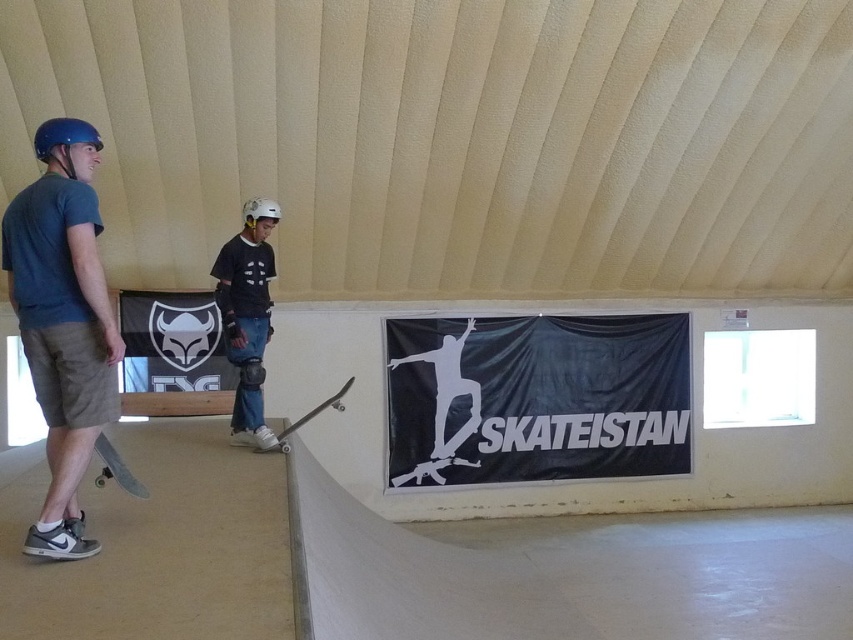
Between matte blue helmet at left and wooden skateboard at lower left, which one has more height?

With more height is matte blue helmet at left.

Who is more distant from viewer, (97, 541) or (96, 436)?

The point (96, 436) is behind.

Image resolution: width=853 pixels, height=640 pixels. Find the location of `matte blue helmet at left`. matte blue helmet at left is located at coordinates (62, 321).

Between white smooth ramp at center and wooden skateboard at center, which one is positioned higher?

Positioned higher is wooden skateboard at center.

The height and width of the screenshot is (640, 853). I want to click on white smooth ramp at center, so click(405, 576).

You are a GUI agent. You are given a task and a screenshot of the screen. Output one action in this format:
    pyautogui.click(x=<x>, y=<y>)
    Task: Click on the white smooth ramp at center
    The width and height of the screenshot is (853, 640).
    Given the screenshot: What is the action you would take?
    click(405, 576)

Where is `matte blue helmet at left`? The image size is (853, 640). matte blue helmet at left is located at coordinates [x=62, y=321].

How distant is matte blue helmet at left from wooden skateboard at center?

The distance of matte blue helmet at left from wooden skateboard at center is 6.44 feet.

Between point (62, 490) and point (283, 432), which one is positioned behind?

The point (283, 432) is more distant.

Find the location of a particular element. The height and width of the screenshot is (640, 853). matte blue helmet at left is located at coordinates (62, 321).